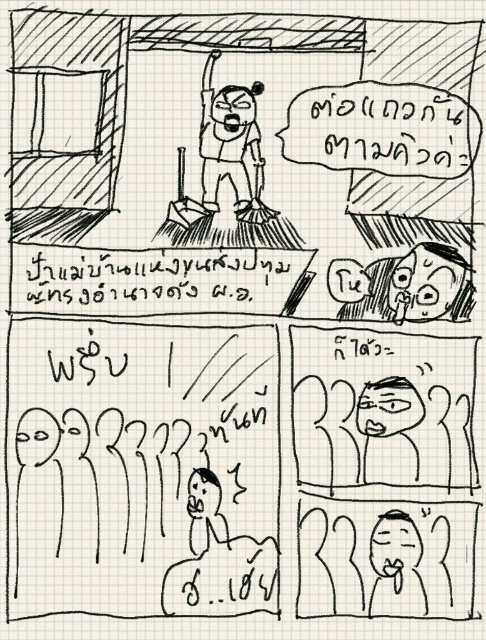
Question: Which object is the closest to the black paper at center?

Choices:
 (A) shiny black face at upper right
 (B) angry face broom at upper center

Answer: (B)

Question: Which point is farther to the camera?

Choices:
 (A) shiny black face at upper right
 (B) black paper at center

Answer: (A)

Question: Can you confirm if black paper at center is bigger than shiny black face at upper right?

Choices:
 (A) no
 (B) yes

Answer: (B)

Question: Can you confirm if angry face broom at upper center is wider than shiny black face at upper right?

Choices:
 (A) no
 (B) yes

Answer: (A)

Question: Which of the following is the closest to the observer?

Choices:
 (A) shiny black face at upper right
 (B) black paper at center

Answer: (B)

Question: Does angry face broom at upper center have a greater width compared to shiny black face at upper right?

Choices:
 (A) yes
 (B) no

Answer: (B)